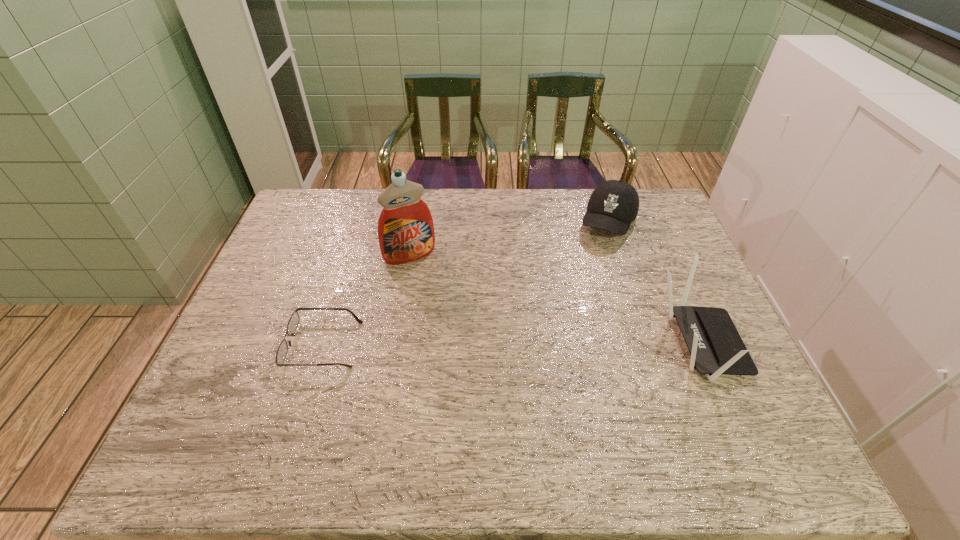
The image size is (960, 540). Identify the location of free space between the second tallest object and the spectacles. (512, 344).

I want to click on free space between the second shortest object and the tallest object, so click(x=509, y=239).

The width and height of the screenshot is (960, 540). Identify the location of empty space between the detergent and the leftmost object. (367, 300).

Find the location of a particular element. The height and width of the screenshot is (540, 960). vacant area that lies between the detergent and the third shortest object is located at coordinates (555, 300).

Find the location of `vacant area between the detergent and the second tallest object`. vacant area between the detergent and the second tallest object is located at coordinates (555, 300).

Where is `vacant space that's between the second shortest object and the shortest object`? vacant space that's between the second shortest object and the shortest object is located at coordinates (466, 284).

Locate an element on the screen. vacant area that lies between the baseball cap and the tallest object is located at coordinates (509, 239).

In order to click on free space between the tallest object and the second shortest object in this screenshot , I will do `click(509, 239)`.

Select which object appears as the second closest to the second shortest object. Please provide its 2D coordinates. Your answer should be formatted as a tuple, i.e. [(x, y)], where the tuple contains the x and y coordinates of a point satisfying the conditions above.

[(406, 233)]

Locate an element on the screen. Image resolution: width=960 pixels, height=540 pixels. object that is the third closest to the shortest object is located at coordinates (716, 347).